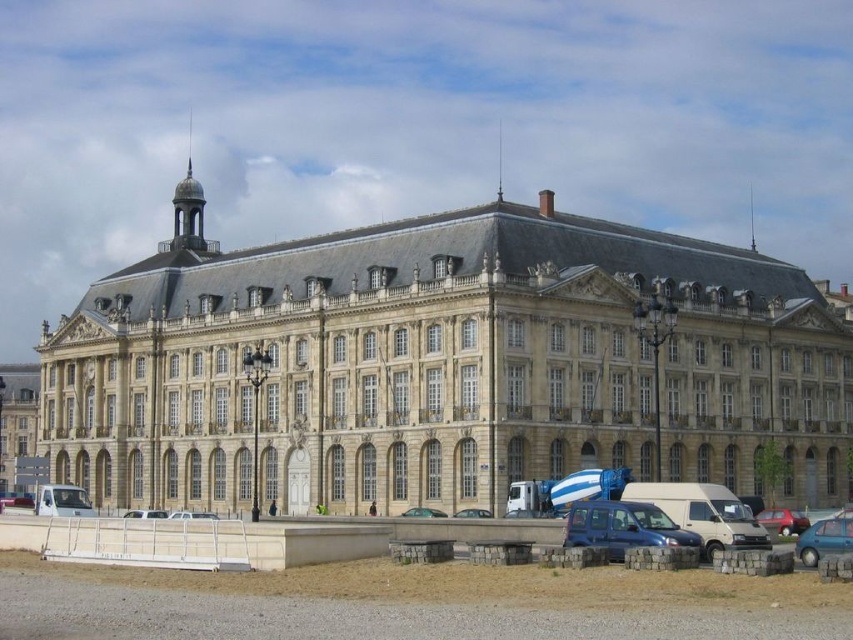
You are a photographer standing in front of the grand classical building. You notice two cars parked at the center of the scene. Which car is closer to the entrance steps? The metallic blue car at center or the silver metallic car at center?

The metallic blue car at center is to the right of the silver metallic car at center. Since the entrance steps are part of the central section of the building, the silver metallic car at center is closer to the entrance steps because it is positioned to the left of the metallic blue car at center.

You are a tour guide leading a group to the entrance of the grand classical building. You notice two cars, a metallic blue car at center and a silver metallic car at center, parked in front of the building. If the tour bus is 12 meters long, can the tour bus fit between the two cars without moving them?

The metallic blue car at center and silver metallic car at center are 19.06 meters apart from each other. Since the tour bus is 12 meters long, it can fit between the two cars as the distance between them is greater than the bus length.